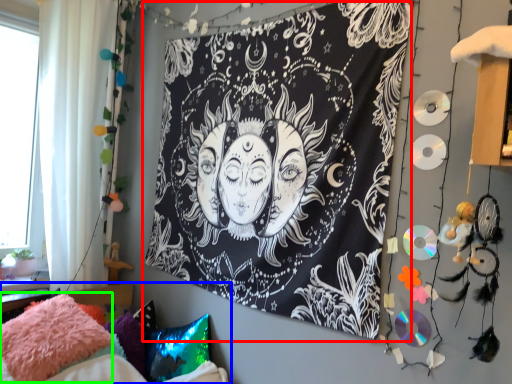
Question: Which is farther away from bulletin board (highlighted by a red box)? furniture (highlighted by a blue box) or pillow (highlighted by a green box)?

Choices:
 (A) furniture
 (B) pillow

Answer: (B)